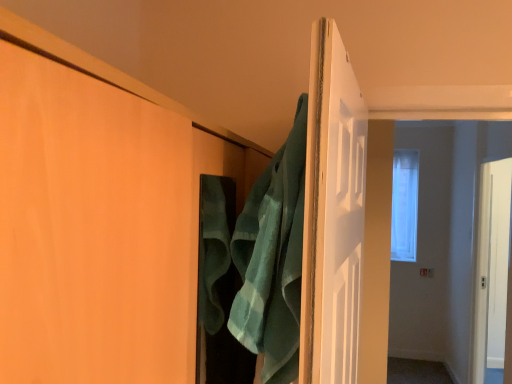
Question: Does green terry cloth bath towel at center have a lesser width compared to clear glass window at center?

Choices:
 (A) yes
 (B) no

Answer: (A)

Question: Can you confirm if green terry cloth bath towel at center is smaller than clear glass window at center?

Choices:
 (A) no
 (B) yes

Answer: (B)

Question: Considering the relative positions of green terry cloth bath towel at center and clear glass window at center in the image provided, is green terry cloth bath towel at center to the left of clear glass window at center from the viewer's perspective?

Choices:
 (A) no
 (B) yes

Answer: (B)

Question: From a real-world perspective, is green terry cloth bath towel at center positioned under clear glass window at center based on gravity?

Choices:
 (A) yes
 (B) no

Answer: (A)

Question: Is green terry cloth bath towel at center far away from clear glass window at center?

Choices:
 (A) no
 (B) yes

Answer: (B)

Question: From the image's perspective, is matte wood door at center above or below green terry cloth bath towel at center?

Choices:
 (A) below
 (B) above

Answer: (A)

Question: Is matte wood door at center inside or outside of green terry cloth bath towel at center?

Choices:
 (A) outside
 (B) inside

Answer: (A)

Question: Would you say matte wood door at center is to the left or to the right of green terry cloth bath towel at center in the picture?

Choices:
 (A) right
 (B) left

Answer: (B)

Question: From a real-world perspective, is matte wood door at center positioned above or below green terry cloth bath towel at center?

Choices:
 (A) below
 (B) above

Answer: (A)

Question: From the image's perspective, is clear glass window at center above or below green terry cloth bath towel at center?

Choices:
 (A) above
 (B) below

Answer: (A)

Question: In the image, is clear glass window at center on the left side or the right side of green terry cloth bath towel at center?

Choices:
 (A) right
 (B) left

Answer: (A)

Question: Considering the positions of clear glass window at center and green terry cloth bath towel at center in the image, is clear glass window at center wider or thinner than green terry cloth bath towel at center?

Choices:
 (A) thin
 (B) wide

Answer: (B)

Question: Is clear glass window at center bigger or smaller than green terry cloth bath towel at center?

Choices:
 (A) big
 (B) small

Answer: (A)

Question: In the image, is green terry cloth bath towel at center positioned in front of or behind matte wood door at center?

Choices:
 (A) front
 (B) behind

Answer: (B)

Question: From a real-world perspective, is green terry cloth bath towel at center above or below matte wood door at center?

Choices:
 (A) below
 (B) above

Answer: (B)